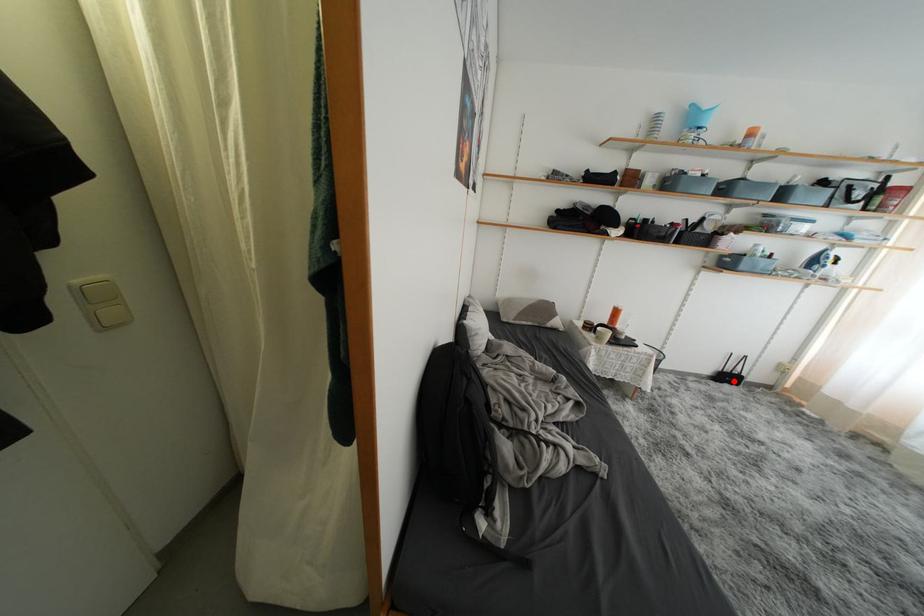
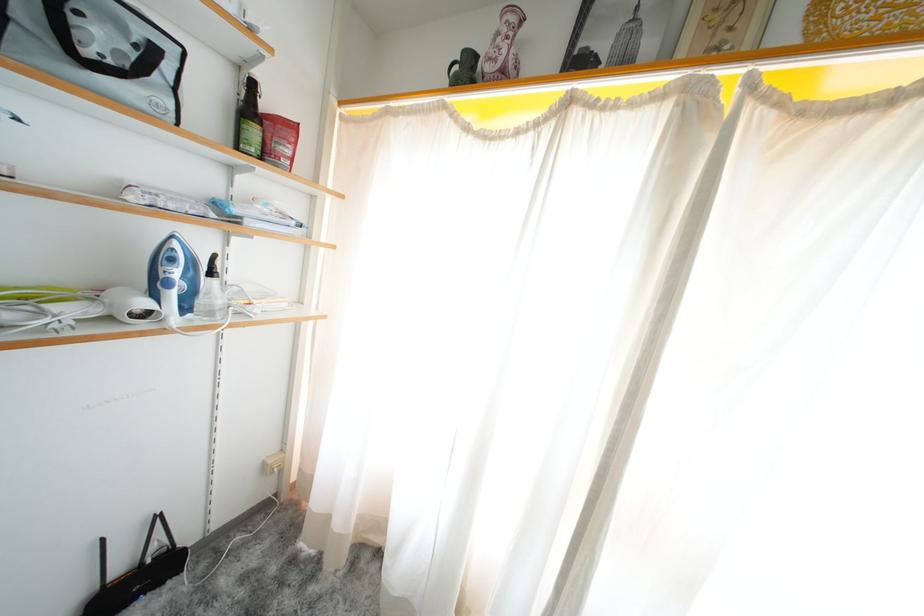
In the second image, find the point that corresponds to the highlighted location in the first image.

(143, 586)